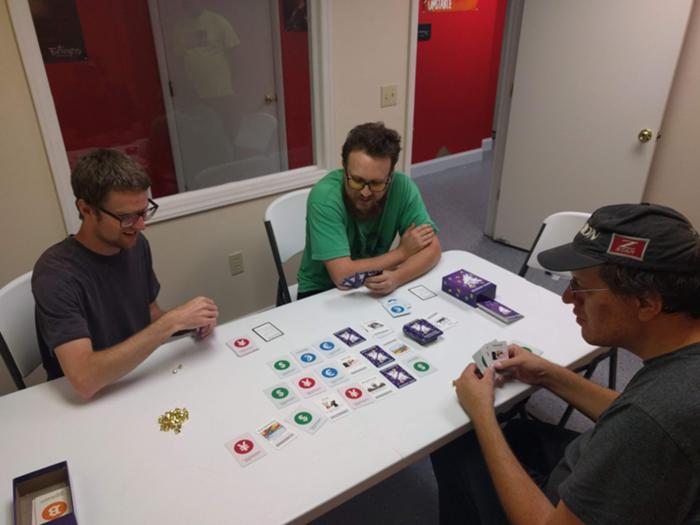
At what (x,y) coordinates should I click in order to perform the action: click on table. Please return your answer as a coordinate pair (x, y). Image resolution: width=700 pixels, height=525 pixels. Looking at the image, I should click on (162, 492).